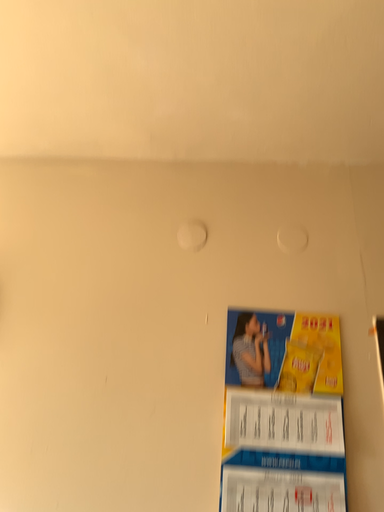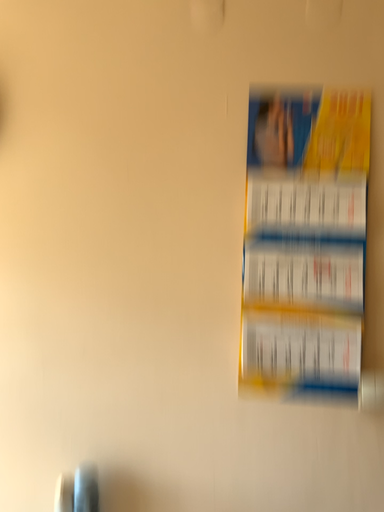
Question: Which way did the camera rotate in the video?

Choices:
 (A) rotated downward
 (B) rotated upward

Answer: (A)